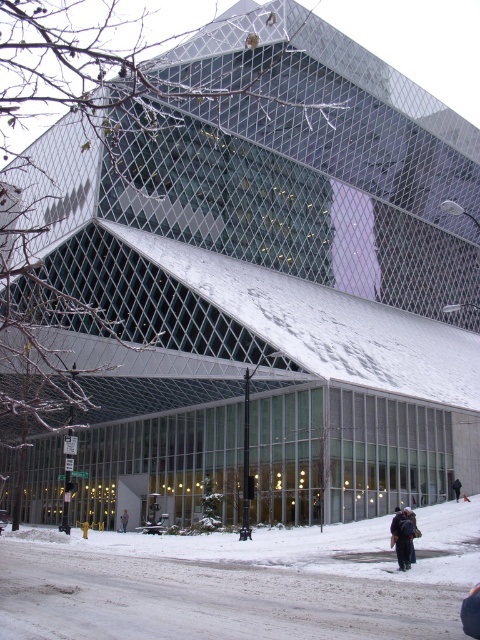
Which is in front, point (405, 536) or point (127, 524)?

Point (405, 536)

Does point (404, 552) lie in front of point (124, 515)?

Yes.

Find the location of a particular element. Image resolution: width=480 pixels, height=640 pixels. dark gray backpack at lower right is located at coordinates (404, 536).

Can you confirm if dark gray backpack at lower right is taller than metallic silver car at lower left?

Incorrect, dark gray backpack at lower right's height is not larger of metallic silver car at lower left's.

Does dark gray backpack at lower right have a larger size compared to metallic silver car at lower left?

No, dark gray backpack at lower right is not bigger than metallic silver car at lower left.

What do you see at coordinates (404, 536) in the screenshot? I see `dark gray backpack at lower right` at bounding box center [404, 536].

Image resolution: width=480 pixels, height=640 pixels. In order to click on dark gray backpack at lower right in this screenshot , I will do `click(404, 536)`.

Who is more forward, [4,520] or [456,497]?

Point [456,497] is more forward.

Does metallic silver car at lower left have a smaller size compared to dark gray jacket at lower right?

Actually, metallic silver car at lower left might be larger than dark gray jacket at lower right.

Measure the distance between metallic silver car at lower left and camera.

metallic silver car at lower left and camera are 50.18 meters apart from each other.

The height and width of the screenshot is (640, 480). Find the location of `metallic silver car at lower left`. metallic silver car at lower left is located at coordinates (2, 518).